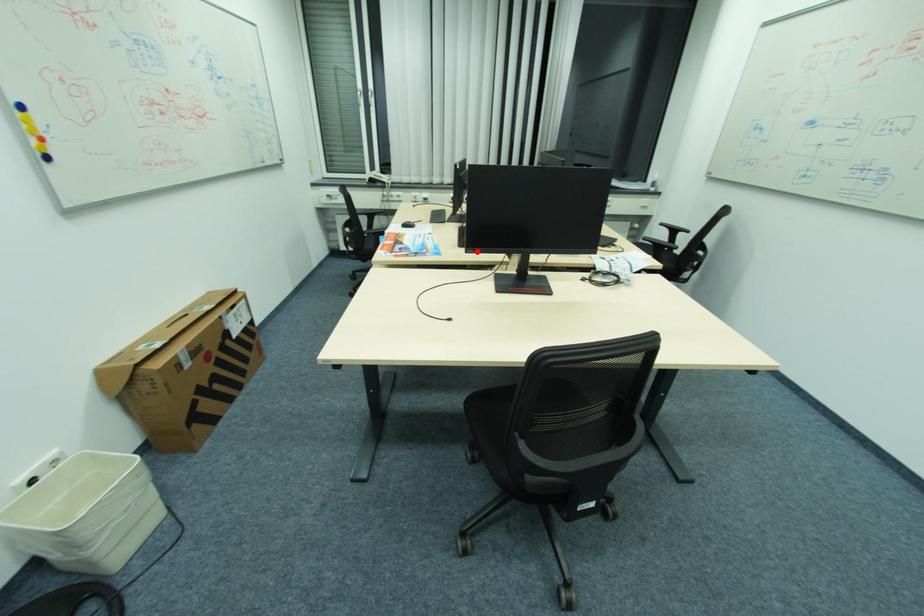
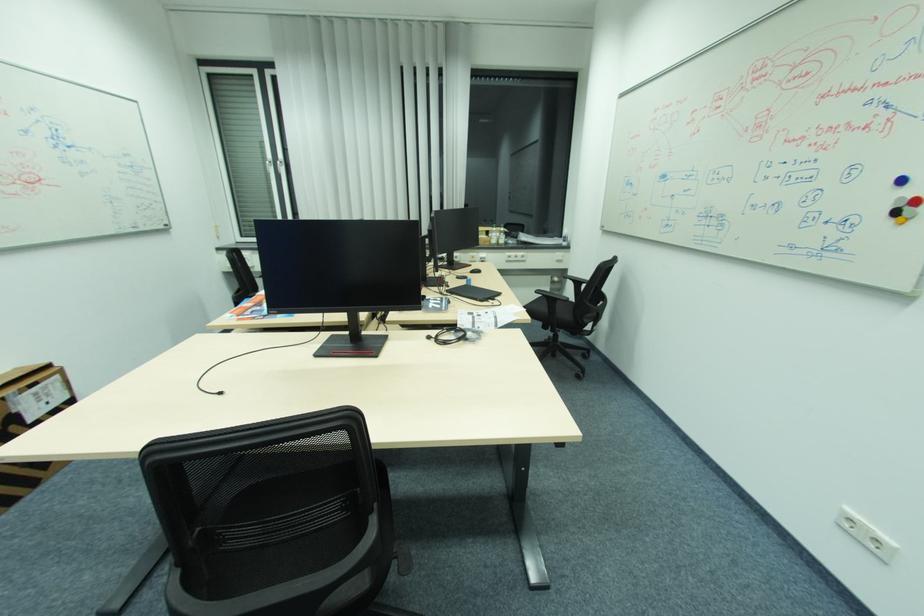
Where in the second image is the point corresponding to the highlighted location from the first image?

(282, 312)